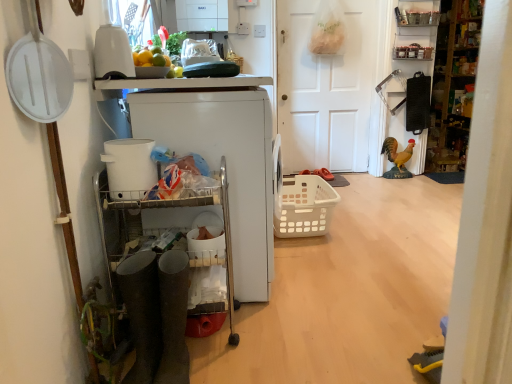
Identify the location of vacant space in yellow matte rooster at right (from a real-world perspective). This screenshot has width=512, height=384. (395, 178).